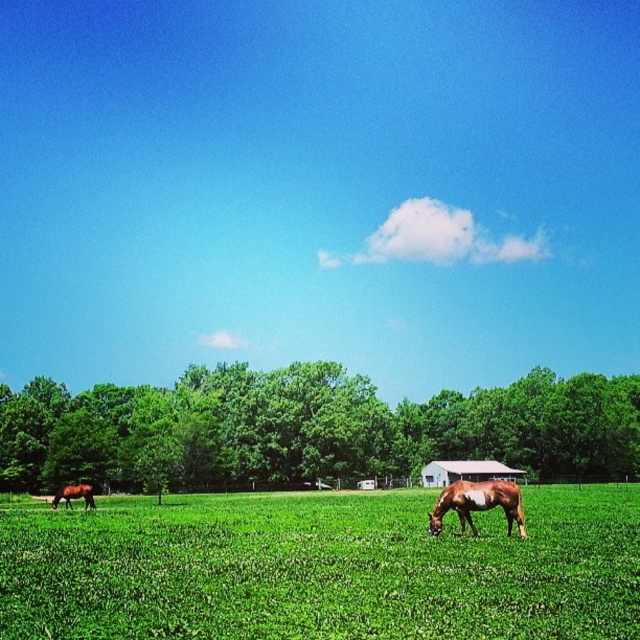
Who is more distant from viewer, (579, 618) or (314, 451)?

The point (314, 451) is behind.

Is green grass pasture at center wider than green leafy tree at center?

Incorrect, green grass pasture at center's width does not surpass green leafy tree at center's.

Who is more forward, (570,500) or (428,420)?

Positioned in front is point (570,500).

This screenshot has height=640, width=640. I want to click on green grass pasture at center, so click(321, 570).

Does green grass pasture at center appear on the right side of brown glossy horse at lower left?

Correct, you'll find green grass pasture at center to the right of brown glossy horse at lower left.

Describe the element at coordinates (321, 570) in the screenshot. I see `green grass pasture at center` at that location.

This screenshot has width=640, height=640. I want to click on green grass pasture at center, so click(321, 570).

Which of these two, green leafy tree at center or brown glossy horse at lower left, stands shorter?

With less height is brown glossy horse at lower left.

Can you confirm if green leafy tree at center is positioned below brown glossy horse at lower left?

No.

What do you see at coordinates (310, 428) in the screenshot?
I see `green leafy tree at center` at bounding box center [310, 428].

Locate an element on the screen. This screenshot has width=640, height=640. green leafy tree at center is located at coordinates (310, 428).